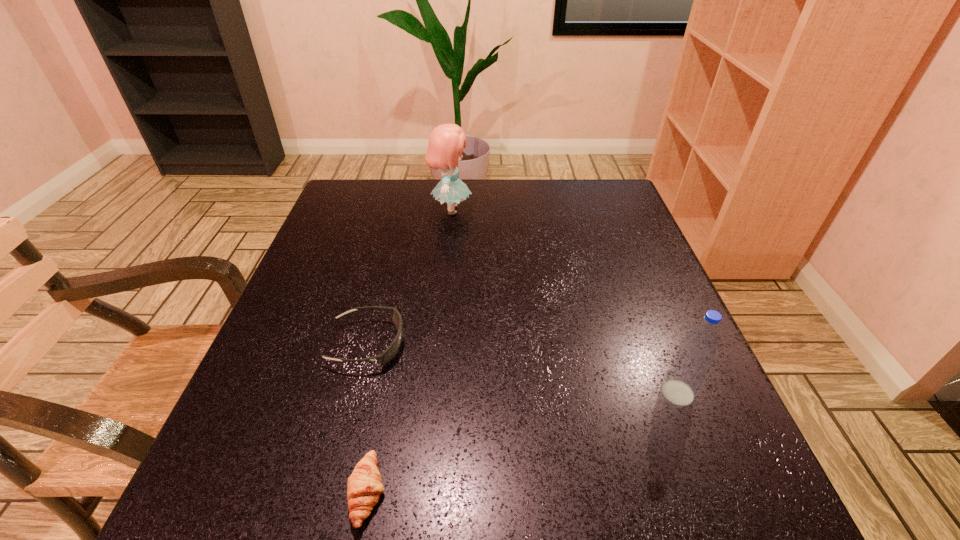
Find the location of `object that is the third closest one to the tallest object`. object that is the third closest one to the tallest object is located at coordinates (364, 485).

Choose which object is the nearest neighbor to the nearest object. Please provide its 2D coordinates. Your answer should be formatted as a tuple, i.e. [(x, y)], where the tuple contains the x and y coordinates of a point satisfying the conditions above.

[(386, 356)]

This screenshot has width=960, height=540. Find the location of `blank space that satisfies the following two spatial constraints: 1. on the lenses of the goggles; 2. on the back side of the second nearest object`. blank space that satisfies the following two spatial constraints: 1. on the lenses of the goggles; 2. on the back side of the second nearest object is located at coordinates (355, 393).

Locate an element on the screen. This screenshot has width=960, height=540. free spot that satisfies the following two spatial constraints: 1. on the front side of the water bottle; 2. on the front-facing side of the nearest object is located at coordinates (717, 492).

The width and height of the screenshot is (960, 540). Identify the location of free space that satisfies the following two spatial constraints: 1. on the front-facing side of the doll; 2. on the back side of the water bottle. (434, 393).

Where is `vacant area in the image that satisfies the following two spatial constraints: 1. on the back side of the rightmost object; 2. on the lenses of the goggles`? Image resolution: width=960 pixels, height=540 pixels. vacant area in the image that satisfies the following two spatial constraints: 1. on the back side of the rightmost object; 2. on the lenses of the goggles is located at coordinates (658, 343).

Where is `free spot that satisfies the following two spatial constraints: 1. on the front-facing side of the tallest object; 2. on the right side of the water bottle`? free spot that satisfies the following two spatial constraints: 1. on the front-facing side of the tallest object; 2. on the right side of the water bottle is located at coordinates (434, 393).

Find the location of a particular element. This screenshot has height=540, width=960. free location that satisfies the following two spatial constraints: 1. on the front-facing side of the third shortest object; 2. on the right side of the farthest object is located at coordinates (434, 393).